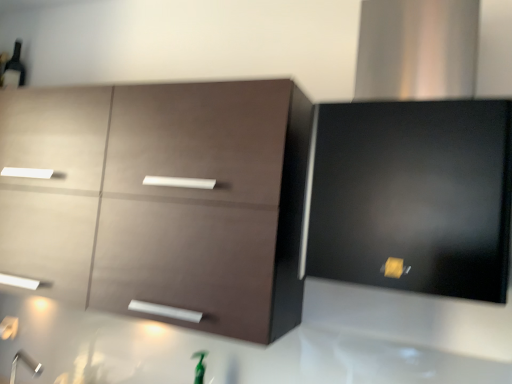
Question: Could you tell me if matte brown cabinet at upper left, marked as the 2th cabinetry in a right-to-left arrangement, is turned towards matte black beer bottle at upper left?

Choices:
 (A) no
 (B) yes

Answer: (A)

Question: Is matte brown cabinet at upper left, the 1th cabinetry from the left, not within matte black beer bottle at upper left?

Choices:
 (A) no
 (B) yes

Answer: (B)

Question: Is matte brown cabinet at upper left, marked as the 2th cabinetry in a right-to-left arrangement, positioned before matte black beer bottle at upper left?

Choices:
 (A) yes
 (B) no

Answer: (A)

Question: From a real-world perspective, is matte brown cabinet at upper left, marked as the 2th cabinetry in a right-to-left arrangement, on top of matte black beer bottle at upper left?

Choices:
 (A) yes
 (B) no

Answer: (B)

Question: Is matte brown cabinet at upper left, the 1th cabinetry from the left, taller than matte black beer bottle at upper left?

Choices:
 (A) no
 (B) yes

Answer: (B)

Question: Is matte brown cabinet at upper left, the 1th cabinetry from the left, taller or shorter than satin black range hood at upper right, the 2th cabinetry in the left-to-right sequence?

Choices:
 (A) short
 (B) tall

Answer: (A)

Question: Visually, is matte brown cabinet at upper left, the 1th cabinetry from the left, positioned to the left or to the right of satin black range hood at upper right, the 2th cabinetry in the left-to-right sequence?

Choices:
 (A) right
 (B) left

Answer: (B)

Question: From a real-world perspective, is matte brown cabinet at upper left, the 1th cabinetry from the left, above or below satin black range hood at upper right, which ranks as the 1th cabinetry in right-to-left order?

Choices:
 (A) above
 (B) below

Answer: (B)

Question: Is matte brown cabinet at upper left, marked as the 2th cabinetry in a right-to-left arrangement, situated inside satin black range hood at upper right, which ranks as the 1th cabinetry in right-to-left order, or outside?

Choices:
 (A) inside
 (B) outside

Answer: (B)

Question: From a real-world perspective, is matte brown cabinet at upper left, the 1th cabinetry from the left, above or below matte black beer bottle at upper left?

Choices:
 (A) above
 (B) below

Answer: (B)

Question: Based on their sizes in the image, would you say matte brown cabinet at upper left, the 1th cabinetry from the left, is bigger or smaller than matte black beer bottle at upper left?

Choices:
 (A) small
 (B) big

Answer: (B)

Question: Is matte brown cabinet at upper left, marked as the 2th cabinetry in a right-to-left arrangement, to the left or to the right of matte black beer bottle at upper left in the image?

Choices:
 (A) left
 (B) right

Answer: (B)

Question: From the image's perspective, relative to matte black beer bottle at upper left, is matte brown cabinet at upper left, marked as the 2th cabinetry in a right-to-left arrangement, above or below?

Choices:
 (A) below
 (B) above

Answer: (A)

Question: From a real-world perspective, relative to matte black beer bottle at upper left, is satin black range hood at upper right, which ranks as the 1th cabinetry in right-to-left order, vertically above or below?

Choices:
 (A) above
 (B) below

Answer: (B)

Question: Relative to matte black beer bottle at upper left, is satin black range hood at upper right, which ranks as the 1th cabinetry in right-to-left order, in front or behind?

Choices:
 (A) behind
 (B) front

Answer: (B)